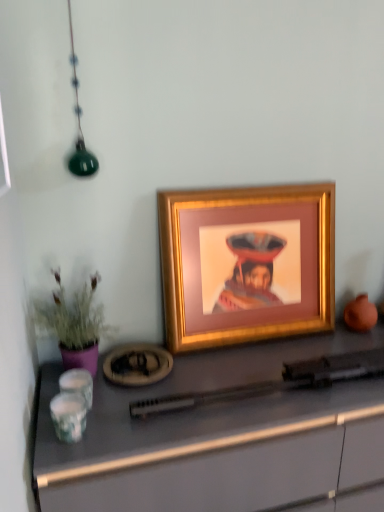
Find the location of a particular element. The width and height of the screenshot is (384, 512). free space in front of purple matte plant at left is located at coordinates (90, 428).